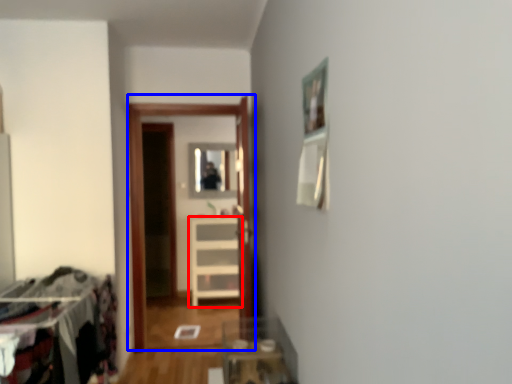
Question: Which object is closer to the camera taking this photo, furniture (highlighted by a red box) or glass door (highlighted by a blue box)?

Choices:
 (A) furniture
 (B) glass door

Answer: (B)